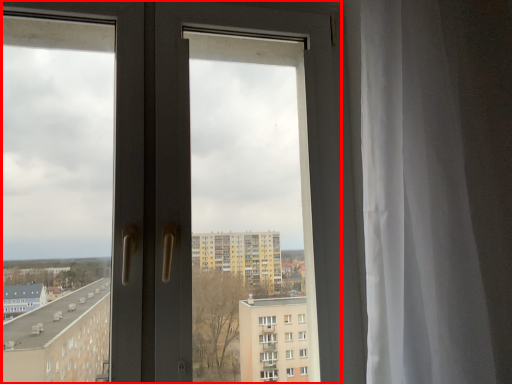
Question: Where is door (annotated by the red box) located in relation to curtain in the image?

Choices:
 (A) left
 (B) right

Answer: (A)